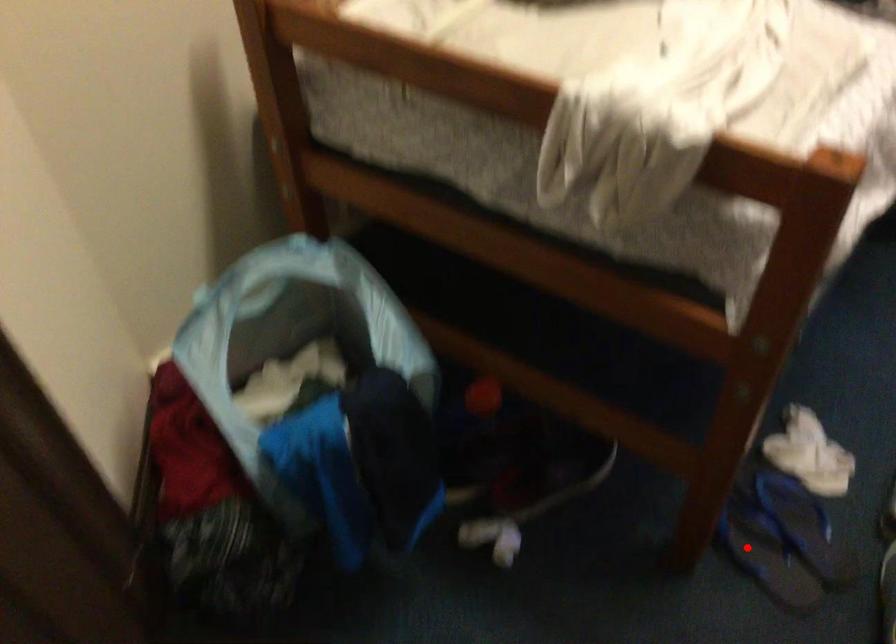
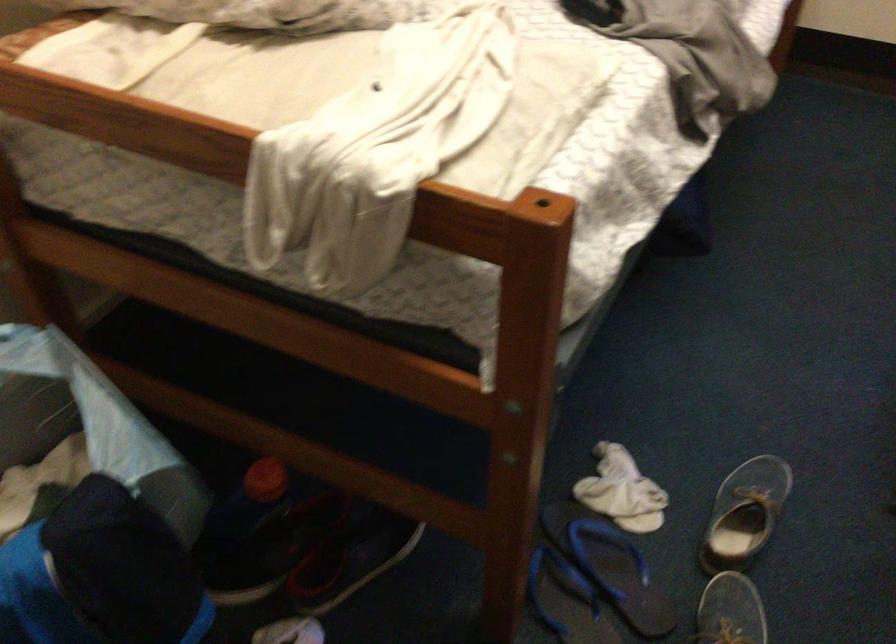
The point at the highlighted location is marked in the first image. Where is the corresponding point in the second image?

(566, 600)